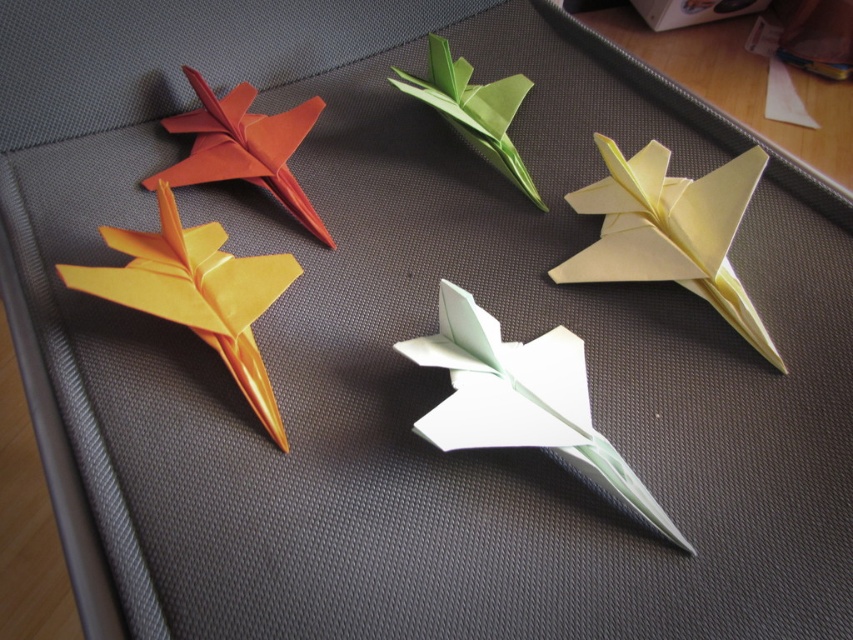
Which is below, matte yellow paper airplane at left or white paper at upper right?

matte yellow paper airplane at left is below.

The image size is (853, 640). Describe the element at coordinates (196, 292) in the screenshot. I see `matte yellow paper airplane at left` at that location.

Is point (231, 314) more distant than point (809, 125)?

No, it is not.

Where is `matte yellow paper airplane at left`? This screenshot has height=640, width=853. matte yellow paper airplane at left is located at coordinates (196, 292).